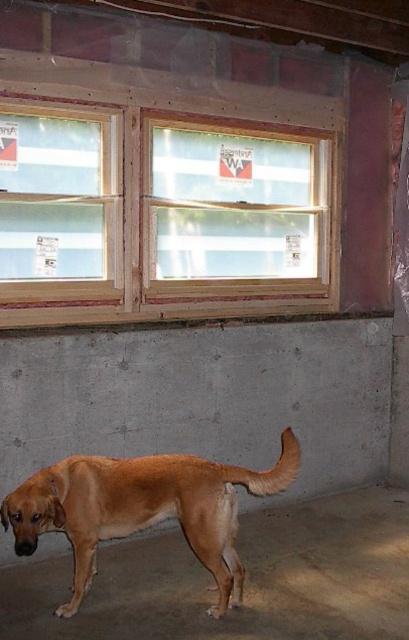
Question: Is wooden frame at upper center thinner than wooden frame at upper left?

Choices:
 (A) yes
 (B) no

Answer: (B)

Question: Is clear glass window at center below brown matte dog at lower left?

Choices:
 (A) no
 (B) yes

Answer: (A)

Question: Which object is positioned closest to the brown matte dog at lower left?

Choices:
 (A) wooden frame at upper center
 (B) clear glass window at center

Answer: (A)

Question: Which of the following is the closest to the observer?

Choices:
 (A) wooden frame at upper center
 (B) clear glass window at center

Answer: (A)

Question: Which point appears closest to the camera in this image?

Choices:
 (A) (94, 208)
 (B) (314, 308)

Answer: (A)

Question: Does clear glass window at center appear over brown matte dog at lower left?

Choices:
 (A) yes
 (B) no

Answer: (A)